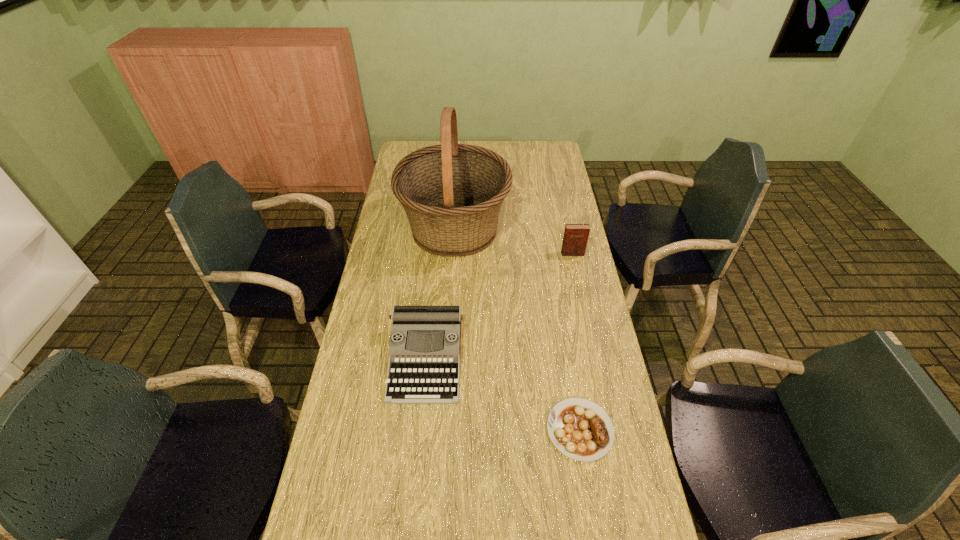
Where is `basket`? This screenshot has width=960, height=540. basket is located at coordinates (452, 193).

Where is `the second tallest object`? The image size is (960, 540). the second tallest object is located at coordinates (575, 239).

Locate an element on the screen. This screenshot has height=540, width=960. the third tallest object is located at coordinates (424, 364).

The image size is (960, 540). Find the location of `steak`. steak is located at coordinates (x=580, y=429).

Where is `vacant region located 0.180m on the front of the tallest object`? vacant region located 0.180m on the front of the tallest object is located at coordinates (450, 303).

The height and width of the screenshot is (540, 960). Identify the location of vacant space located 0.160m on the front cover of the third shortest object. click(579, 287).

The height and width of the screenshot is (540, 960). Find the location of `blank area located on the typing side of the third tallest object`. blank area located on the typing side of the third tallest object is located at coordinates coord(415,471).

The image size is (960, 540). I want to click on vacant space situated on the left of the shortest object, so click(x=464, y=430).

This screenshot has width=960, height=540. Find the location of `basket located in the left edge section of the desktop`. basket located in the left edge section of the desktop is located at coordinates (452, 193).

Locate an element on the screen. This screenshot has width=960, height=540. typewriter present at the left edge is located at coordinates (424, 364).